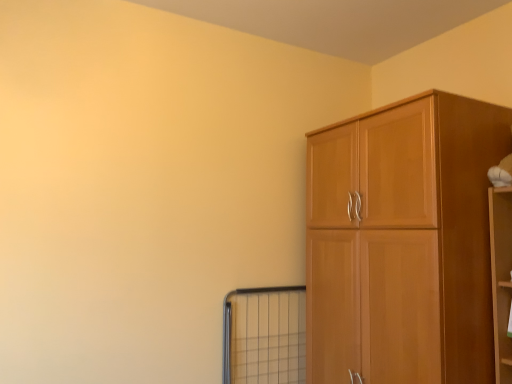
Where is `light brown wood cupboard at right`? This screenshot has width=512, height=384. light brown wood cupboard at right is located at coordinates (403, 242).

The width and height of the screenshot is (512, 384). Describe the element at coordinates (403, 242) in the screenshot. I see `light brown wood cupboard at right` at that location.

Where is `metal grid window at lower center`? metal grid window at lower center is located at coordinates (265, 336).

Image resolution: width=512 pixels, height=384 pixels. Describe the element at coordinates (265, 336) in the screenshot. I see `metal grid window at lower center` at that location.

At what (x,y) coordinates should I click in order to perform the action: click on light brown wood cupboard at right. Please return your answer as a coordinate pair (x, y). The image size is (512, 384). Looking at the image, I should click on (403, 242).

Considering the relative positions of metal grid window at lower center and light brown wood cupboard at right in the image provided, is metal grid window at lower center to the right of light brown wood cupboard at right from the viewer's perspective?

Incorrect, metal grid window at lower center is not on the right side of light brown wood cupboard at right.

Consider the image. Considering the positions of objects metal grid window at lower center and light brown wood cupboard at right in the image provided, who is in front, metal grid window at lower center or light brown wood cupboard at right?

Positioned in front is light brown wood cupboard at right.

Between point (243, 330) and point (431, 262), which one is positioned behind?

The point (243, 330) is more distant.

From the image's perspective, between metal grid window at lower center and light brown wood cupboard at right, which one is located above?

light brown wood cupboard at right is shown above in the image.

From a real-world perspective, is metal grid window at lower center below light brown wood cupboard at right?

Yes, from a real-world perspective, metal grid window at lower center is below light brown wood cupboard at right.

Which object is wider, metal grid window at lower center or light brown wood cupboard at right?

With larger width is light brown wood cupboard at right.

Considering the sizes of objects metal grid window at lower center and light brown wood cupboard at right in the image provided, who is shorter, metal grid window at lower center or light brown wood cupboard at right?

Standing shorter between the two is metal grid window at lower center.

Looking at the image, does metal grid window at lower center seem bigger or smaller compared to light brown wood cupboard at right?

Considering their sizes, metal grid window at lower center takes up less space than light brown wood cupboard at right.

Is metal grid window at lower center positioned beyond the bounds of light brown wood cupboard at right?

Yes, metal grid window at lower center is outside of light brown wood cupboard at right.

Is the surface of metal grid window at lower center in direct contact with light brown wood cupboard at right?

metal grid window at lower center is not next to light brown wood cupboard at right, and they're not touching.

Is metal grid window at lower center facing away from light brown wood cupboard at right?

metal grid window at lower center does not have its back to light brown wood cupboard at right.

What's the angular difference between metal grid window at lower center and light brown wood cupboard at right's facing directions?

There is a 89.9-degree angle between the facing directions of metal grid window at lower center and light brown wood cupboard at right.

Where is `window on the left of light brown wood cupboard at right`? window on the left of light brown wood cupboard at right is located at coordinates (265, 336).

Which is more to the left, light brown wood cupboard at right or metal grid window at lower center?

Positioned to the left is metal grid window at lower center.

Does light brown wood cupboard at right come in front of metal grid window at lower center?

Yes, light brown wood cupboard at right is closer to the camera.

Which is closer to the camera, (409,212) or (274,350)?

Clearly, point (409,212) is closer to the camera than point (274,350).

From the image's perspective, relative to metal grid window at lower center, is light brown wood cupboard at right above or below?

light brown wood cupboard at right is situated higher than metal grid window at lower center in the image.

From a real-world perspective, is light brown wood cupboard at right physically located above or below metal grid window at lower center?

From a real-world perspective, light brown wood cupboard at right is physically above metal grid window at lower center.

Between light brown wood cupboard at right and metal grid window at lower center, which one has larger width?

light brown wood cupboard at right is wider.

In the scene shown: Considering the relative sizes of light brown wood cupboard at right and metal grid window at lower center in the image provided, is light brown wood cupboard at right shorter than metal grid window at lower center?

No.

Who is smaller, light brown wood cupboard at right or metal grid window at lower center?

With smaller size is metal grid window at lower center.

Is light brown wood cupboard at right outside of metal grid window at lower center?

light brown wood cupboard at right is positioned outside metal grid window at lower center.

Is light brown wood cupboard at right positioned far away from metal grid window at lower center?

Actually, light brown wood cupboard at right and metal grid window at lower center are a little close together.

Does light brown wood cupboard at right turn towards metal grid window at lower center?

Yes, light brown wood cupboard at right is facing metal grid window at lower center.

Can you tell me how much light brown wood cupboard at right and metal grid window at lower center differ in facing direction?

light brown wood cupboard at right and metal grid window at lower center are facing 89.9 degrees away from each other.

This screenshot has width=512, height=384. I want to click on window on the left of the light brown wood cupboard at right, so click(265, 336).

Where is `cupboard in front of the metal grid window at lower center`? The height and width of the screenshot is (384, 512). cupboard in front of the metal grid window at lower center is located at coordinates (403, 242).

Find the location of a particular element. Image resolution: width=512 pixels, height=384 pixels. window lying behind the light brown wood cupboard at right is located at coordinates (265, 336).